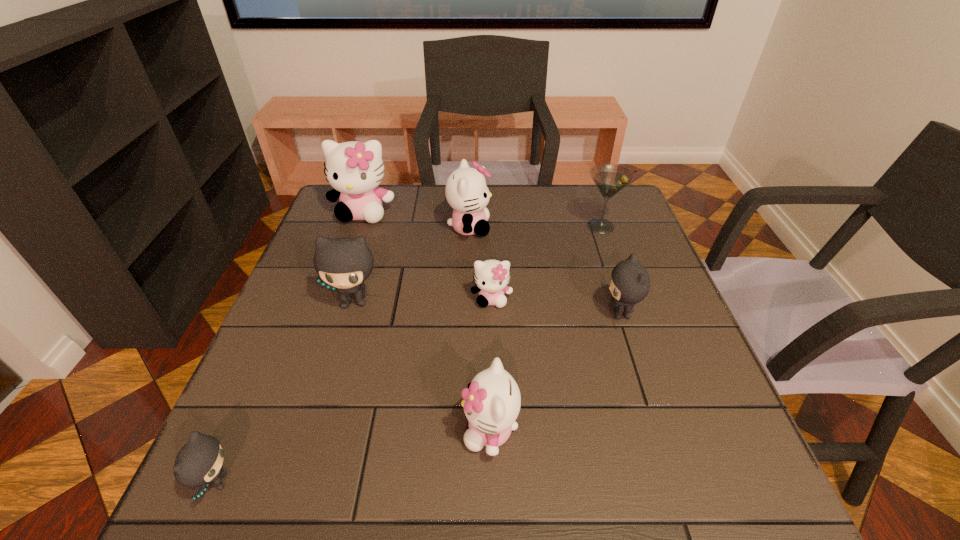
Where is `the leftmost gray kitten`? the leftmost gray kitten is located at coordinates (199, 462).

At what (x,y) coordinates should I click in order to perform the action: click on blank area located on the front-facing side of the tallest object. Please return your answer as a coordinate pair (x, y). Image resolution: width=960 pixels, height=540 pixels. Looking at the image, I should click on (323, 329).

Identify the location of vacant space located on the front-facing side of the third smallest white kitten. (588, 228).

Find the location of `free point located on the front of the martini`. free point located on the front of the martini is located at coordinates (614, 266).

Where is `free space located on the front-facing side of the biggest gray kitten`? The width and height of the screenshot is (960, 540). free space located on the front-facing side of the biggest gray kitten is located at coordinates (308, 456).

Locate an element on the screen. vacant space positioned 0.350m on the front-facing side of the nearest white kitten is located at coordinates (271, 430).

At what (x,y) coordinates should I click in order to perform the action: click on vacant space located on the front-facing side of the nearest white kitten. Please return your answer as a coordinate pair (x, y). The width and height of the screenshot is (960, 540). Looking at the image, I should click on (342, 430).

You are a GUI agent. You are given a task and a screenshot of the screen. Output one action in this format:
    pyautogui.click(x=<x>, y=<y>)
    Task: Click on the vacant region located 0.190m on the front-facing side of the nearest white kitten
    
    Given the screenshot: What is the action you would take?
    pyautogui.click(x=358, y=430)

You are a GUI agent. You are given a task and a screenshot of the screen. Output one action in this format:
    pyautogui.click(x=<x>, y=<y>)
    Task: Click on the free location located 0.090m on the front-facing side of the rightmost gray kitten
    Image resolution: width=960 pixels, height=540 pixels.
    Given the screenshot: What is the action you would take?
    pyautogui.click(x=564, y=313)

Identify the location of vacant space located 0.230m on the front-facing side of the rightmost gray kitten. Image resolution: width=960 pixels, height=540 pixels. (504, 313).